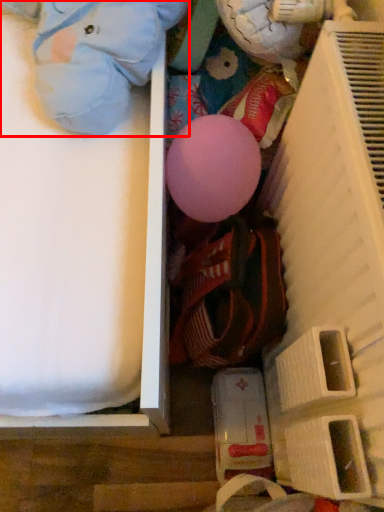
Question: In this image, where is toy (annotated by the red box) located relative to shelf?

Choices:
 (A) right
 (B) left

Answer: (B)